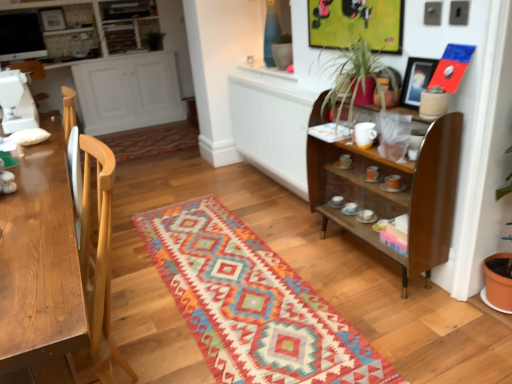
Question: Should I look upward or downward to see multicolored woven mat at center?

Choices:
 (A) up
 (B) down

Answer: (B)

Question: Does multicolored woven mat at center have a smaller size compared to matte black picture frame at upper right?

Choices:
 (A) no
 (B) yes

Answer: (A)

Question: Is multicolored woven mat at center far from matte black picture frame at upper right?

Choices:
 (A) yes
 (B) no

Answer: (A)

Question: Is multicolored woven mat at center turned away from matte black picture frame at upper right?

Choices:
 (A) no
 (B) yes

Answer: (A)

Question: From the image's perspective, is multicolored woven mat at center over matte black picture frame at upper right?

Choices:
 (A) no
 (B) yes

Answer: (A)

Question: Does multicolored woven mat at center appear on the right side of matte black picture frame at upper right?

Choices:
 (A) yes
 (B) no

Answer: (B)

Question: From a real-world perspective, is multicolored woven mat at center over matte black picture frame at upper right?

Choices:
 (A) no
 (B) yes

Answer: (A)

Question: Is there a large distance between green leafy plant at upper center and light wood desk at left?

Choices:
 (A) yes
 (B) no

Answer: (A)

Question: Is green leafy plant at upper center further to camera compared to light wood desk at left?

Choices:
 (A) yes
 (B) no

Answer: (A)

Question: From a real-world perspective, is green leafy plant at upper center positioned over light wood desk at left based on gravity?

Choices:
 (A) yes
 (B) no

Answer: (A)

Question: From the image's perspective, is green leafy plant at upper center below light wood desk at left?

Choices:
 (A) no
 (B) yes

Answer: (A)

Question: Considering the relative sizes of green leafy plant at upper center and light wood desk at left in the image provided, is green leafy plant at upper center shorter than light wood desk at left?

Choices:
 (A) yes
 (B) no

Answer: (A)

Question: Is light wood desk at left located within green leafy plant at upper center?

Choices:
 (A) no
 (B) yes

Answer: (A)

Question: Does light wood desk at left have a smaller size compared to green leafy plant at upper center?

Choices:
 (A) no
 (B) yes

Answer: (A)